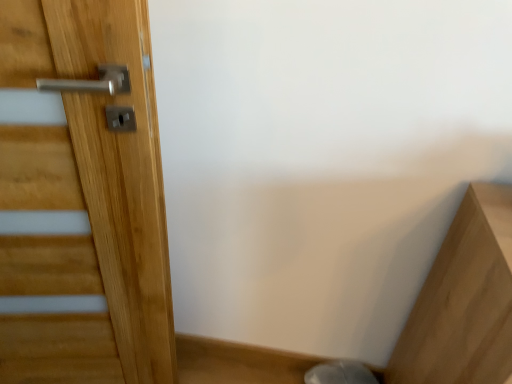
Question: Should I look upward or downward to see natural wood door at left?

Choices:
 (A) down
 (B) up

Answer: (A)